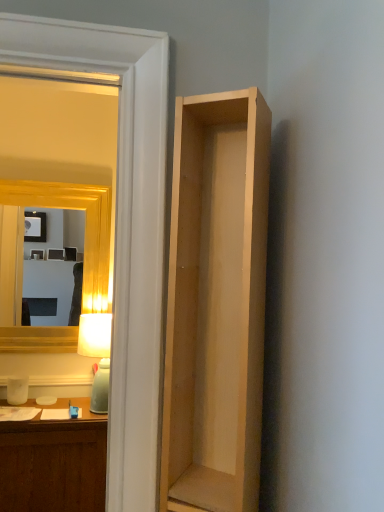
Question: Is gold wooden mirror at upper left taller than matte white lamp at left?

Choices:
 (A) no
 (B) yes

Answer: (B)

Question: From the image's perspective, is gold wooden mirror at upper left located beneath matte white lamp at left?

Choices:
 (A) yes
 (B) no

Answer: (B)

Question: Is gold wooden mirror at upper left surrounding matte white lamp at left?

Choices:
 (A) yes
 (B) no

Answer: (B)

Question: Is gold wooden mirror at upper left positioned behind matte white lamp at left?

Choices:
 (A) yes
 (B) no

Answer: (A)

Question: Can you see gold wooden mirror at upper left touching matte white lamp at left?

Choices:
 (A) yes
 (B) no

Answer: (B)

Question: From their relative heights in the image, would you say natural wood shelf at right is taller or shorter than matte white lamp at left?

Choices:
 (A) short
 (B) tall

Answer: (B)

Question: Does point (256, 467) appear closer or farther from the camera than point (96, 315)?

Choices:
 (A) farther
 (B) closer

Answer: (B)

Question: Is natural wood shelf at right bigger or smaller than matte white lamp at left?

Choices:
 (A) small
 (B) big

Answer: (B)

Question: From the image's perspective, is natural wood shelf at right positioned above or below matte white lamp at left?

Choices:
 (A) below
 (B) above

Answer: (B)

Question: Considering the positions of matte white lamp at left and transparent glass door at upper left in the image, is matte white lamp at left bigger or smaller than transparent glass door at upper left?

Choices:
 (A) big
 (B) small

Answer: (B)

Question: Considering their positions, is matte white lamp at left located in front of or behind transparent glass door at upper left?

Choices:
 (A) behind
 (B) front

Answer: (A)

Question: Is matte white lamp at left wider or thinner than transparent glass door at upper left?

Choices:
 (A) thin
 (B) wide

Answer: (B)

Question: Considering the positions of matte white lamp at left and transparent glass door at upper left in the image, is matte white lamp at left taller or shorter than transparent glass door at upper left?

Choices:
 (A) short
 (B) tall

Answer: (A)

Question: Considering the positions of transparent glass door at upper left and matte white lamp at left in the image, is transparent glass door at upper left wider or thinner than matte white lamp at left?

Choices:
 (A) wide
 (B) thin

Answer: (B)

Question: In terms of height, does transparent glass door at upper left look taller or shorter compared to matte white lamp at left?

Choices:
 (A) short
 (B) tall

Answer: (B)